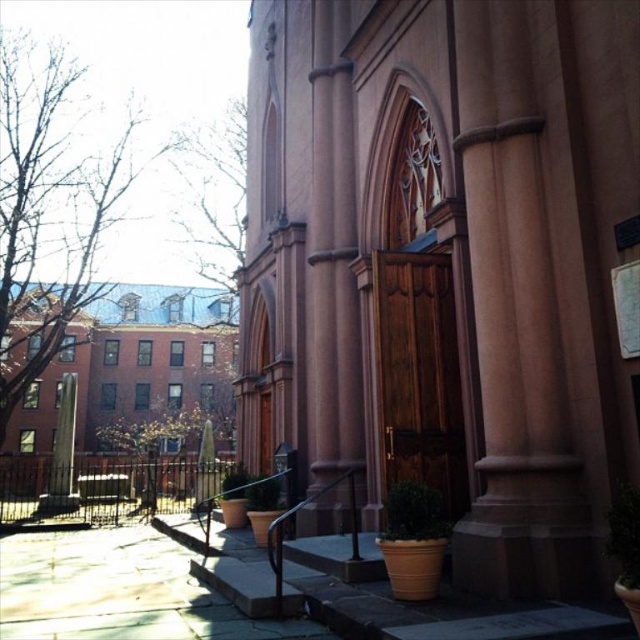
Does green matte planter at lower center have a greater height compared to green leafy plant at lower right?

Incorrect, green matte planter at lower center's height is not larger of green leafy plant at lower right's.

Is green matte planter at lower center to the left of green leafy plant at lower right from the viewer's perspective?

Indeed, green matte planter at lower center is positioned on the left side of green leafy plant at lower right.

Is point (403, 538) positioned behind point (611, 525)?

Yes.

The height and width of the screenshot is (640, 640). I want to click on green matte planter at lower center, so click(413, 513).

Does brown brick building at left appear over green leafy plant at lower right?

Correct, brown brick building at left is located above green leafy plant at lower right.

Which is behind, point (84, 397) or point (614, 522)?

Point (84, 397)

Locate an element on the screen. brown brick building at left is located at coordinates tap(138, 372).

Does smooth pink stone church at center have a greater height compared to green leafy plant at lower right?

Correct, smooth pink stone church at center is much taller as green leafy plant at lower right.

Is point (611, 490) less distant than point (618, 522)?

No, it is not.

This screenshot has height=640, width=640. What do you see at coordinates (449, 266) in the screenshot? I see `smooth pink stone church at center` at bounding box center [449, 266].

You are a GUI agent. You are given a task and a screenshot of the screen. Output one action in this format:
    pyautogui.click(x=<x>, y=<y>)
    Task: Click on the smooth pink stone church at center
    This screenshot has width=640, height=640.
    Given the screenshot: What is the action you would take?
    pyautogui.click(x=449, y=266)